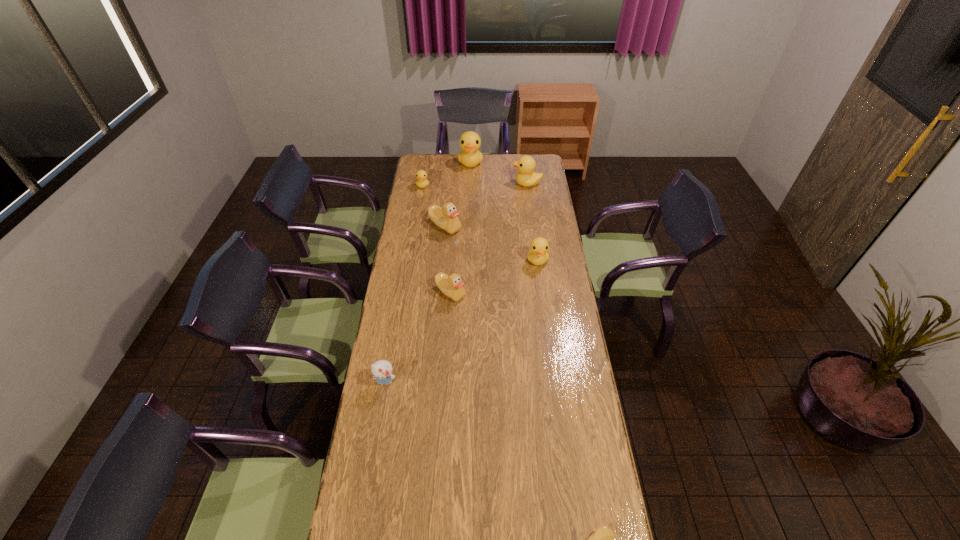
This screenshot has width=960, height=540. Identify the location of free point located 0.070m on the face of the smallest yellow duck. (420, 198).

I want to click on object that is at the far edge, so click(470, 156).

This screenshot has height=540, width=960. What are the coordinates of `kitten present at the left edge` in the screenshot? It's located at click(382, 370).

Locate an element on the screen. Image resolution: width=960 pixels, height=540 pixels. vacant space at the far edge is located at coordinates (444, 161).

In order to click on free region at the left edge of the desktop in this screenshot , I will do `click(394, 385)`.

Identify the location of vacant space at the right edge of the desktop. (616, 532).

Image resolution: width=960 pixels, height=540 pixels. I want to click on free space that is in between the fourth farthest object and the third smallest yellow duck, so click(x=486, y=205).

Image resolution: width=960 pixels, height=540 pixels. Find the location of `free space between the third yellow duck from right to left and the biggest beige duck`. free space between the third yellow duck from right to left and the biggest beige duck is located at coordinates (458, 194).

The image size is (960, 540). Identify the location of free space between the kitten and the second farthest beige duck. (418, 337).

This screenshot has height=540, width=960. What are the coordinates of `free point between the nearest yellow duck and the tallest object` in the screenshot? It's located at (504, 212).